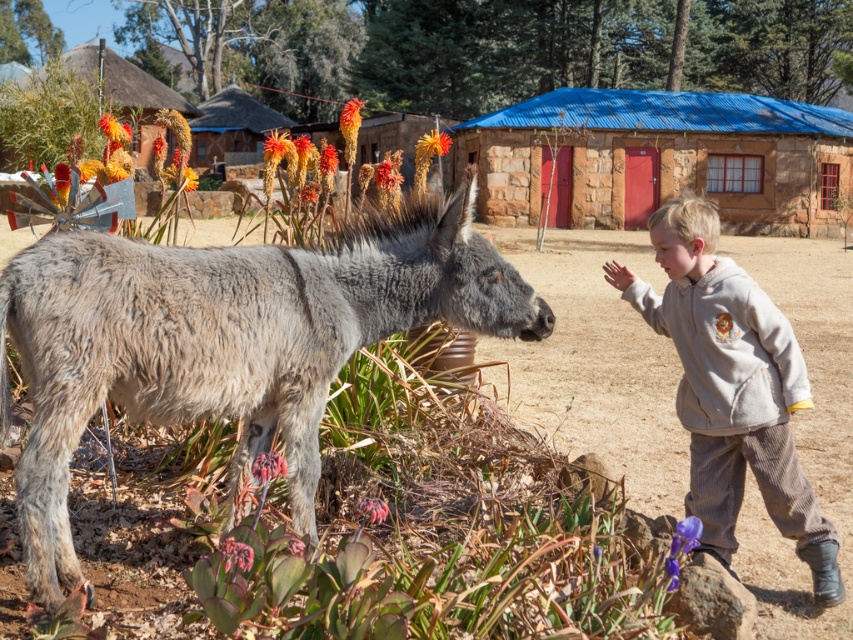
Who is positioned more to the right, gray fuzzy donkey at left or thatched straw hut at upper left?

gray fuzzy donkey at left

Where is `gray fuzzy donkey at left`? Image resolution: width=853 pixels, height=640 pixels. gray fuzzy donkey at left is located at coordinates (229, 340).

Locate an element on the screen. blue corrugated metal hut at center is located at coordinates (660, 160).

In the scene shown: Does blue corrugated metal hut at center have a lesser height compared to light gray corduroy pants at right?

No, blue corrugated metal hut at center is not shorter than light gray corduroy pants at right.

You are a GUI agent. You are given a task and a screenshot of the screen. Output one action in this format:
    pyautogui.click(x=<x>, y=<y>)
    Task: Click on the blue corrugated metal hut at center
    The height and width of the screenshot is (640, 853).
    Given the screenshot: What is the action you would take?
    click(660, 160)

Is point (381, 268) farther from camera compared to point (758, 141)?

No, it is in front of (758, 141).

Can you confirm if gray fuzzy donkey at left is thinner than blue corrugated metal hut at center?

Yes, gray fuzzy donkey at left is thinner than blue corrugated metal hut at center.

Is point (129, 376) positioned before point (804, 228)?

Yes, it is in front of point (804, 228).

This screenshot has width=853, height=640. Find the location of `gray fuzzy donkey at left`. gray fuzzy donkey at left is located at coordinates (229, 340).